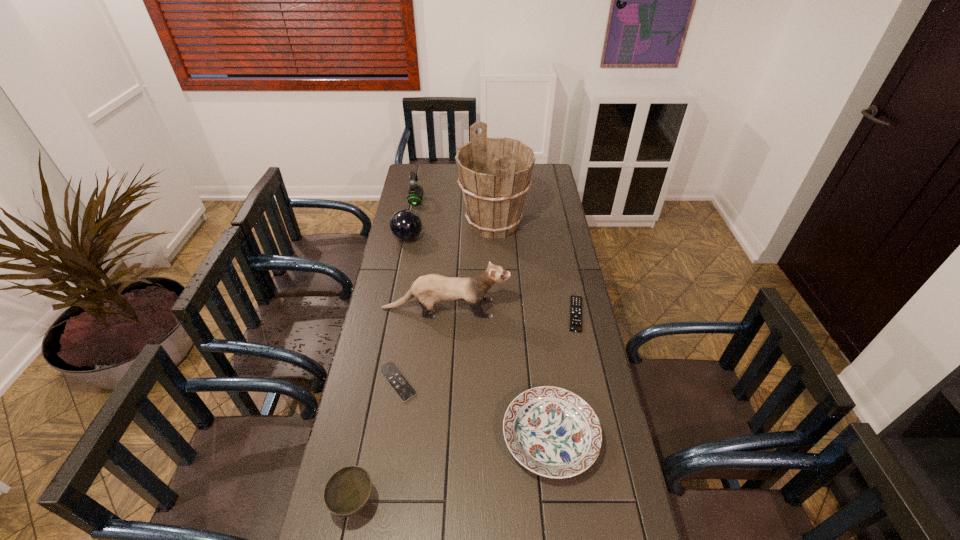
This screenshot has height=540, width=960. Find the location of `bowling ball that is at the left edge`. bowling ball that is at the left edge is located at coordinates (405, 224).

At what (x,y) coordinates should I click in order to perform the action: click on bowl present at the left edge. Please return your answer as a coordinate pair (x, y). The height and width of the screenshot is (540, 960). Looking at the image, I should click on (348, 490).

At what (x,y) coordinates should I click in order to perform the action: click on remote control that is at the left edge. Please return your answer as a coordinate pair (x, y). Looking at the image, I should click on (404, 390).

The height and width of the screenshot is (540, 960). I want to click on plate located at the right edge, so click(x=552, y=432).

Where is `remote control present at the right edge`? The image size is (960, 540). remote control present at the right edge is located at coordinates (576, 301).

This screenshot has width=960, height=540. In the image, there is a desktop. Identify the location of vacant space at the left edge. (409, 276).

Locate an element on the screen. The image size is (960, 540). vacant space at the right edge of the desktop is located at coordinates (611, 434).

Locate an element on the screen. This screenshot has width=960, height=540. vacant space at the far left corner is located at coordinates (438, 164).

Image resolution: width=960 pixels, height=540 pixels. What are the coordinates of `vacant position at the far right corner of the desktop` in the screenshot? It's located at (543, 181).

Locate an element on the screen. The image size is (960, 540). vacant space that's between the headset and the tallest object is located at coordinates (455, 213).